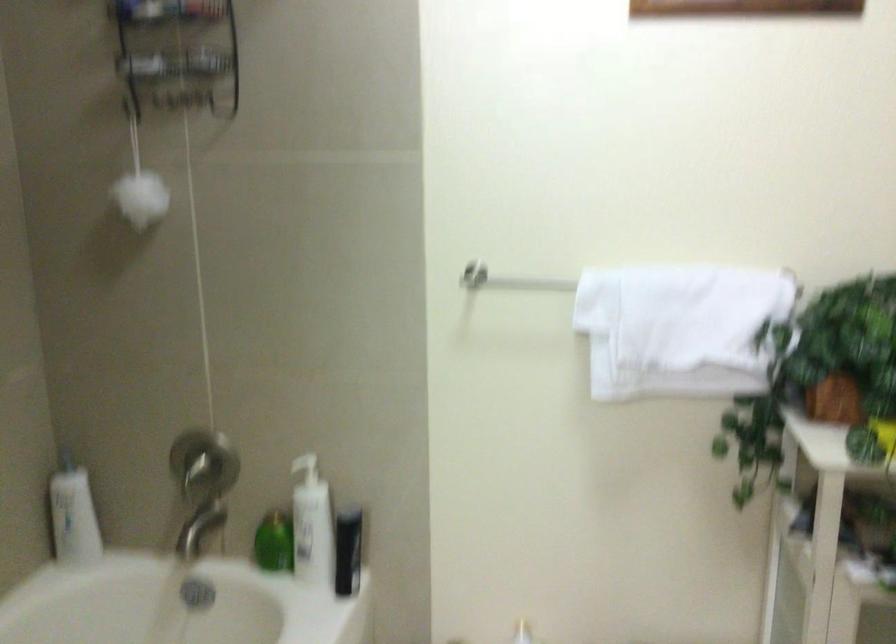
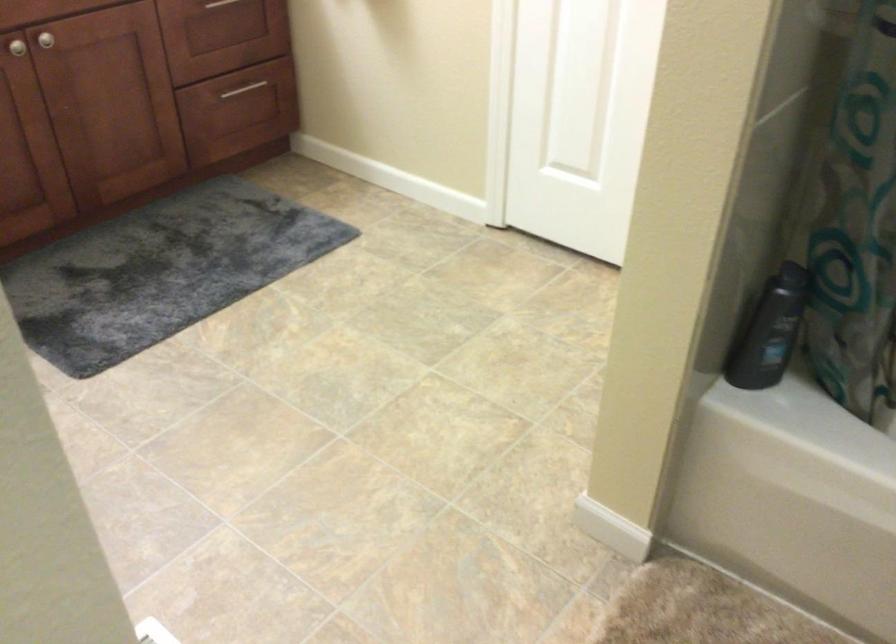
Based on the continuous images, in which direction is the camera rotating?

The camera rotated toward left-down.